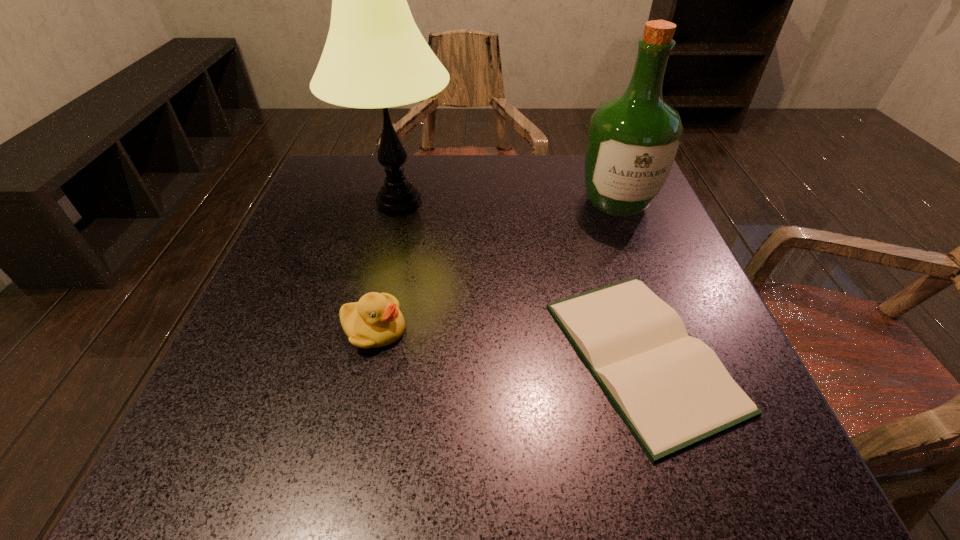
The height and width of the screenshot is (540, 960). In the image, there is a desktop. In order to click on free region at the right edge in this screenshot , I will do `click(667, 272)`.

Identify the location of vacant space at the far left corner. This screenshot has height=540, width=960. (324, 157).

At what (x,y) coordinates should I click in order to perform the action: click on vacant space at the near left corner. Please return your answer as a coordinate pair (x, y). Image resolution: width=960 pixels, height=540 pixels. Looking at the image, I should click on (268, 445).

This screenshot has height=540, width=960. I want to click on vacant area that lies between the lamp and the liquor, so click(508, 202).

You are a GUI agent. You are given a task and a screenshot of the screen. Output one action in this format:
    pyautogui.click(x=<x>, y=<y>)
    Task: Click on the free area in between the duckling and the lamp
    
    Given the screenshot: What is the action you would take?
    pyautogui.click(x=387, y=266)

Identify the location of empty location between the hardback book and the liquor. Image resolution: width=960 pixels, height=540 pixels. (630, 279).

Where is `free point between the lamp and the hardback book`? free point between the lamp and the hardback book is located at coordinates (520, 279).

You are a GUI agent. You are given a task and a screenshot of the screen. Output one action in this format:
    pyautogui.click(x=<x>, y=<y>)
    Task: Click on the vacant point located between the lamp and the hardback book
    The width and height of the screenshot is (960, 540).
    Given the screenshot: What is the action you would take?
    pyautogui.click(x=520, y=279)

Image resolution: width=960 pixels, height=540 pixels. I want to click on free spot between the lamp and the liquor, so click(x=508, y=202).

The image size is (960, 540). What are the coordinates of `free space between the hardback book and the lamp` in the screenshot? It's located at (520, 279).